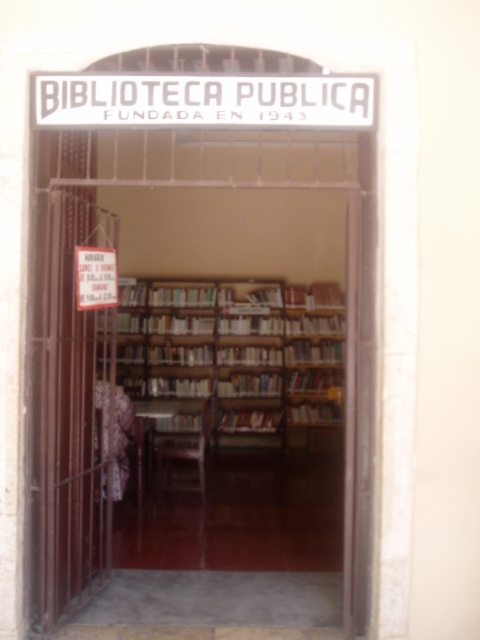
From the picture: You are standing at the entrance of the library and want to read both the white metallic sign at upper center and the white paper sign at center. Which sign is closer to you?

The white metallic sign at upper center is closer to you because it is only 3.76 feet away from the white paper sign at center, meaning the metallic sign is nearer than the paper sign.

You are standing at the entrance of the BIBLIOTECA PUBLICA FUNDADA EN 1943. There is a point marked at coordinates point (302,115). Can you determine if this point is closer to you or farther away than 4 meters?

The distance of point (302,115) from viewer is 4.02 meters, so it is slightly farther than 4 meters.

You are a librarian who needs to retrieve the hardcover book at center. The wooden bookcase at center is blocking your path. Can you move the bookcase to access the book?

The wooden bookcase at center is positioned over hardcover book at center, so you cannot access the book without moving the bookcase. However, since the bookcase is likely heavy and fixed in place, it might not be feasible to move it easily.